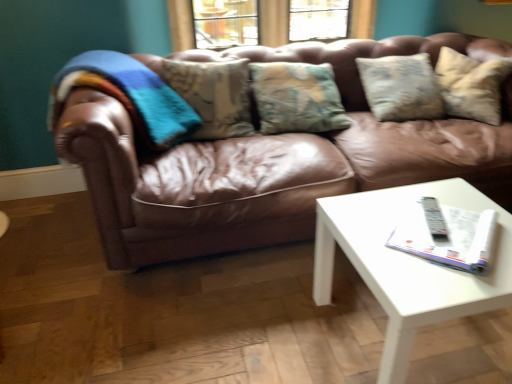
Question: Is brown leather couch at center at the left side of white glossy coffee table at lower right?

Choices:
 (A) no
 (B) yes

Answer: (B)

Question: From the image's perspective, is brown leather couch at center located above white glossy coffee table at lower right?

Choices:
 (A) yes
 (B) no

Answer: (A)

Question: Can you confirm if brown leather couch at center is positioned to the right of white glossy coffee table at lower right?

Choices:
 (A) no
 (B) yes

Answer: (A)

Question: Is brown leather couch at center not inside white glossy coffee table at lower right?

Choices:
 (A) no
 (B) yes

Answer: (B)

Question: Does brown leather couch at center have a greater height compared to white glossy coffee table at lower right?

Choices:
 (A) yes
 (B) no

Answer: (A)

Question: Is brown leather couch at center closer to camera compared to white glossy coffee table at lower right?

Choices:
 (A) yes
 (B) no

Answer: (B)

Question: Is white glossy magazine at center right not within brown leather couch at center?

Choices:
 (A) no
 (B) yes

Answer: (B)

Question: From a real-world perspective, is white glossy magazine at center right below brown leather couch at center?

Choices:
 (A) yes
 (B) no

Answer: (B)

Question: Could you tell me if white glossy magazine at center right is turned towards brown leather couch at center?

Choices:
 (A) no
 (B) yes

Answer: (B)

Question: Are white glossy magazine at center right and brown leather couch at center beside each other?

Choices:
 (A) no
 (B) yes

Answer: (A)

Question: Is white glossy magazine at center right bigger than brown leather couch at center?

Choices:
 (A) no
 (B) yes

Answer: (A)

Question: Is white glossy magazine at center right positioned with its back to brown leather couch at center?

Choices:
 (A) yes
 (B) no

Answer: (B)

Question: From the image's perspective, is white glossy coffee table at lower right on top of brown leather couch at center?

Choices:
 (A) yes
 (B) no

Answer: (B)